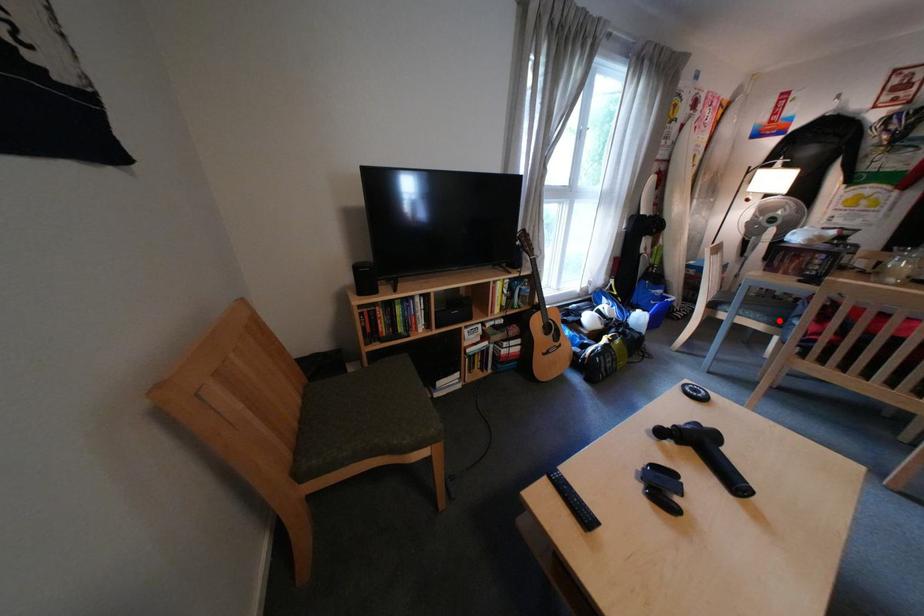
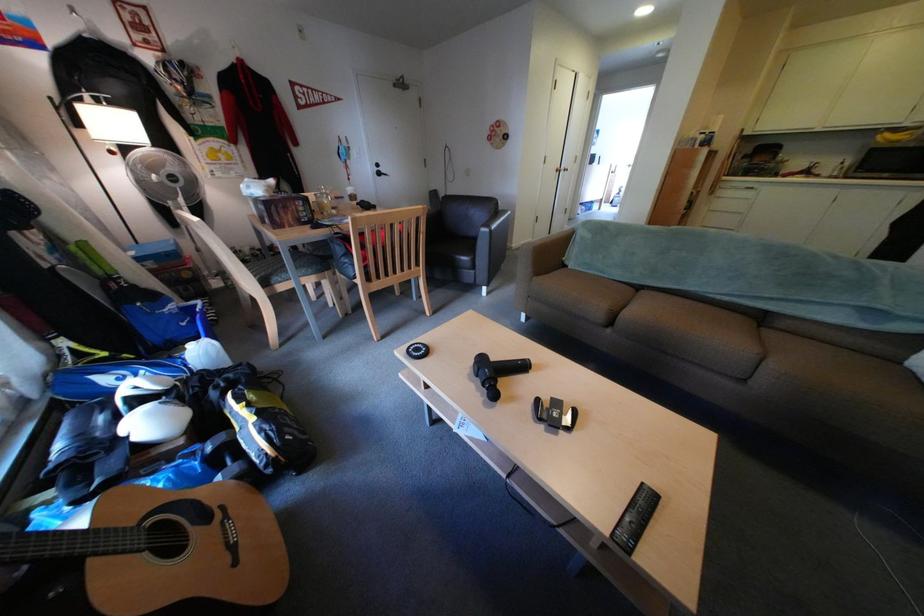
Where in the second image is the point corresponding to the highlighted location from the first image?

(324, 272)